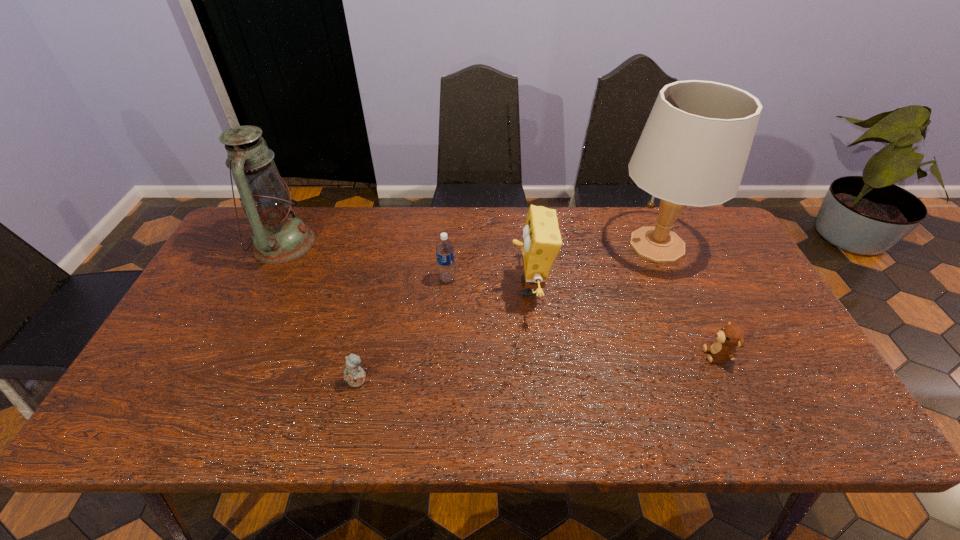
This screenshot has width=960, height=540. I want to click on free area in between the third tallest object and the nearer teddy bear, so click(x=444, y=334).

Identify the location of free space between the oil lamp and the third shortest object. This screenshot has height=540, width=960. (366, 261).

Identify which object is the fifth nearest to the third object from right to left. Please provide its 2D coordinates. Your answer should be formatted as a tuple, i.e. [(x, y)], where the tuple contains the x and y coordinates of a point satisfying the conditions above.

[(278, 237)]

Find the location of `object that is the closest one to the nearest object`. object that is the closest one to the nearest object is located at coordinates (444, 249).